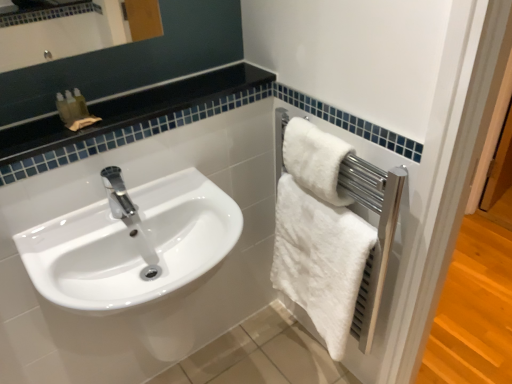
Question: Can you confirm if black glossy countertop at upper left is thinner than white fluffy towel at right, the first towel in the top-to-bottom sequence?

Choices:
 (A) no
 (B) yes

Answer: (A)

Question: Is black glossy countertop at upper left not inside white fluffy towel at right, which is counted as the 2th towel, starting from the bottom?

Choices:
 (A) yes
 (B) no

Answer: (A)

Question: Is black glossy countertop at upper left taller than white fluffy towel at right, which is counted as the 2th towel, starting from the bottom?

Choices:
 (A) no
 (B) yes

Answer: (A)

Question: Considering the relative positions of black glossy countertop at upper left and white fluffy towel at right, which is counted as the 2th towel, starting from the bottom, in the image provided, is black glossy countertop at upper left to the right of white fluffy towel at right, which is counted as the 2th towel, starting from the bottom, from the viewer's perspective?

Choices:
 (A) no
 (B) yes

Answer: (A)

Question: From the image's perspective, is black glossy countertop at upper left beneath white fluffy towel at right, which is counted as the 2th towel, starting from the bottom?

Choices:
 (A) yes
 (B) no

Answer: (B)

Question: Does black glossy countertop at upper left appear on the left side of white fluffy towel at right, the first towel in the top-to-bottom sequence?

Choices:
 (A) yes
 (B) no

Answer: (A)

Question: Does white fluffy towel at right, the second towel from the top, appear on the right side of black glossy countertop at upper left?

Choices:
 (A) yes
 (B) no

Answer: (A)

Question: Considering the relative positions of white fluffy towel at right, the first towel ordered from the bottom, and black glossy countertop at upper left in the image provided, is white fluffy towel at right, the first towel ordered from the bottom, to the left of black glossy countertop at upper left from the viewer's perspective?

Choices:
 (A) yes
 (B) no

Answer: (B)

Question: Can black glossy countertop at upper left be found inside white fluffy towel at right, the second towel from the top?

Choices:
 (A) yes
 (B) no

Answer: (B)

Question: Is white fluffy towel at right, the first towel ordered from the bottom, thinner than black glossy countertop at upper left?

Choices:
 (A) no
 (B) yes

Answer: (B)

Question: Does white fluffy towel at right, the first towel ordered from the bottom, touch black glossy countertop at upper left?

Choices:
 (A) yes
 (B) no

Answer: (B)

Question: Considering the relative sizes of white fluffy towel at right, the first towel ordered from the bottom, and black glossy countertop at upper left in the image provided, is white fluffy towel at right, the first towel ordered from the bottom, taller than black glossy countertop at upper left?

Choices:
 (A) yes
 (B) no

Answer: (A)

Question: Could white glossy sink at left be considered to be inside white fluffy towel at right, which is counted as the 2th towel, starting from the bottom?

Choices:
 (A) no
 (B) yes

Answer: (A)